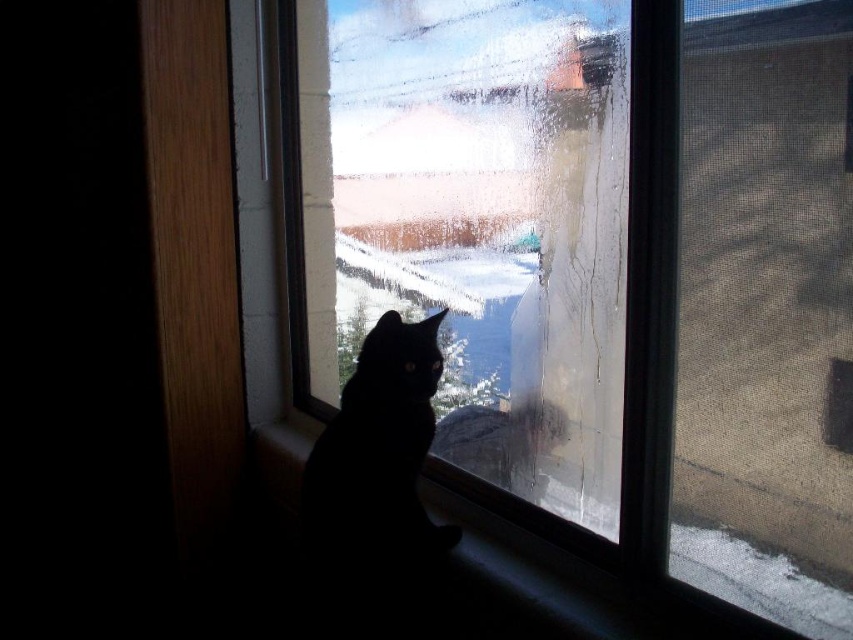
Question: In this image, where is transparent glass window at center located relative to black matte cat at center?

Choices:
 (A) left
 (B) right

Answer: (B)

Question: Which of the following is the farthest from the observer?

Choices:
 (A) (682, 596)
 (B) (689, 480)
 (C) (430, 374)

Answer: (C)

Question: Is transparent glass window at center wider than black matte cat at center?

Choices:
 (A) no
 (B) yes

Answer: (B)

Question: Which object appears closest to the camera in this image?

Choices:
 (A) transparent glass window at center
 (B) black matte cat at center

Answer: (A)

Question: Which object is closer to the camera taking this photo?

Choices:
 (A) black matte cat at center
 (B) transparent glass window at center

Answer: (B)

Question: From the image, what is the correct spatial relationship of transparent glass window at center in relation to smooth wood window sill at lower center?

Choices:
 (A) left
 (B) right

Answer: (A)